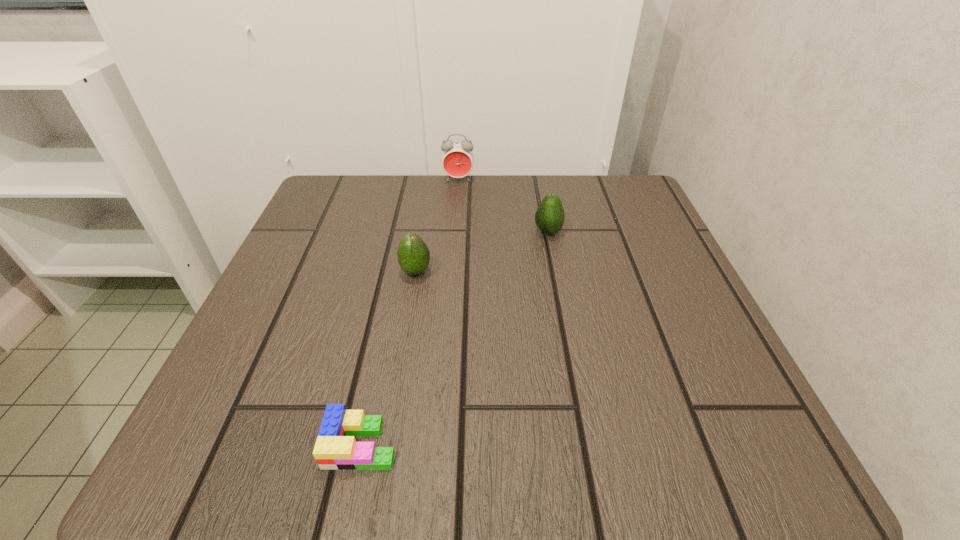
The width and height of the screenshot is (960, 540). Find the location of `free spot at the near left corner of the desktop`. free spot at the near left corner of the desktop is located at coordinates (243, 412).

The width and height of the screenshot is (960, 540). In the image, there is a desktop. Find the location of `vacant region at the far right corner`. vacant region at the far right corner is located at coordinates (572, 183).

Image resolution: width=960 pixels, height=540 pixels. I want to click on vacant space at the near right corner of the desktop, so click(x=658, y=434).

The width and height of the screenshot is (960, 540). What are the coordinates of `vacant area between the alarm clock and the second nearest object` in the screenshot? It's located at (437, 226).

This screenshot has width=960, height=540. I want to click on vacant point located between the farthest object and the nearer avocado, so click(x=437, y=226).

Identify the location of free area in between the second farthest object and the nearest object. This screenshot has width=960, height=540. (455, 338).

Identify the location of unoccupied position between the nearest object and the left avocado. click(x=389, y=358).

Where is `vacant area that lies between the third farthest object and the right avocado`? The height and width of the screenshot is (540, 960). vacant area that lies between the third farthest object and the right avocado is located at coordinates (482, 252).

You are a GUI agent. You are given a task and a screenshot of the screen. Output one action in this format:
    pyautogui.click(x=<x>, y=<y>)
    Task: Click on the vacant area that lies between the second nearest object and the shortest object
    Image resolution: width=960 pixels, height=540 pixels.
    Given the screenshot: What is the action you would take?
    pyautogui.click(x=389, y=358)

Locate an element on the screen. The width and height of the screenshot is (960, 540). vacant space that is in between the third farthest object and the nearest object is located at coordinates (389, 358).